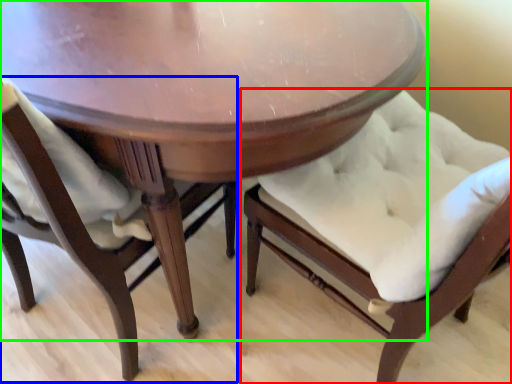
Question: Based on their relative distances, which object is farther from chair (highlighted by a red box)? Choose from chair (highlighted by a blue box) and table (highlighted by a green box).

Choices:
 (A) chair
 (B) table

Answer: (A)